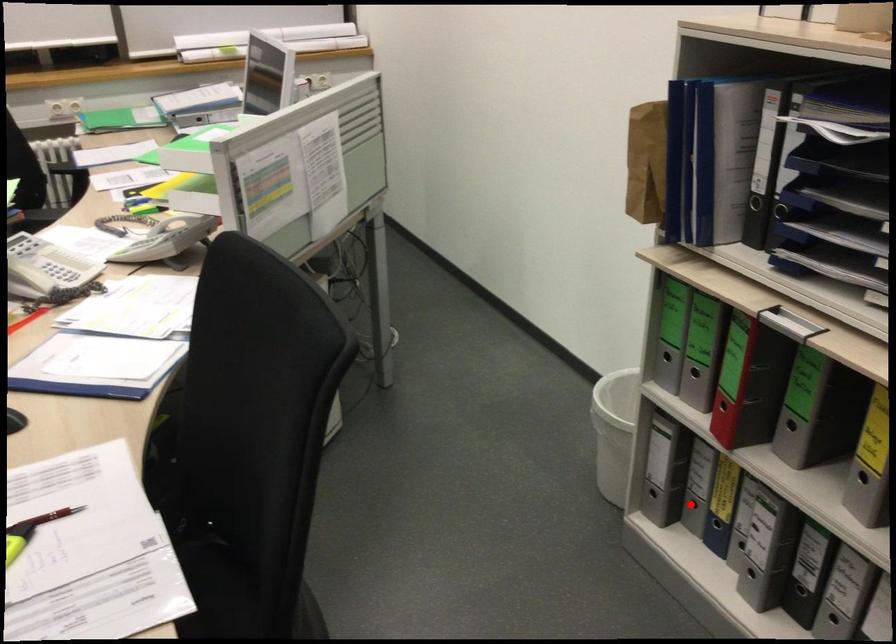
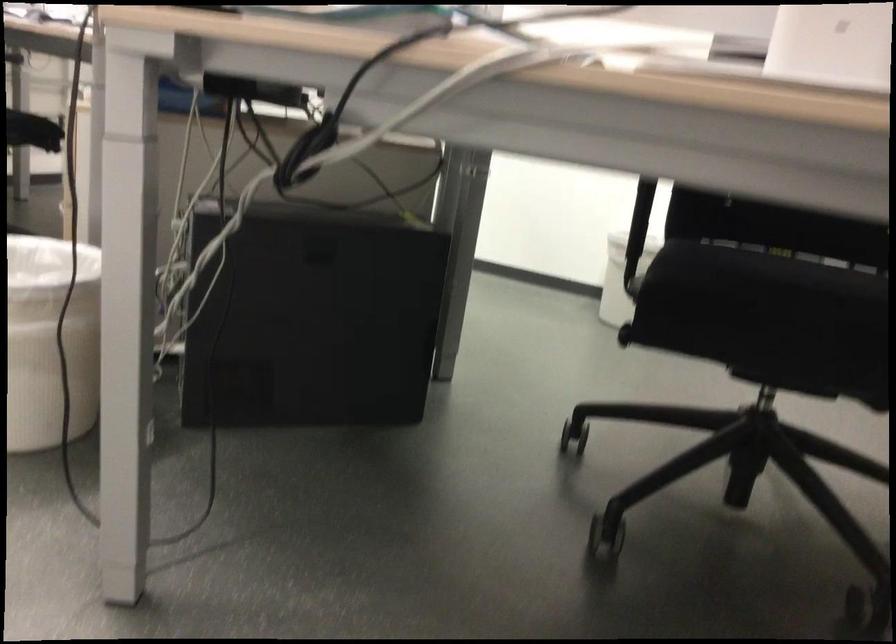
Question: I am providing you with two images of the same scene from different viewpoints. A red point is marked on the first image. Is the red point's position out of view in image 2?

Choices:
 (A) Yes
 (B) No

Answer: (A)